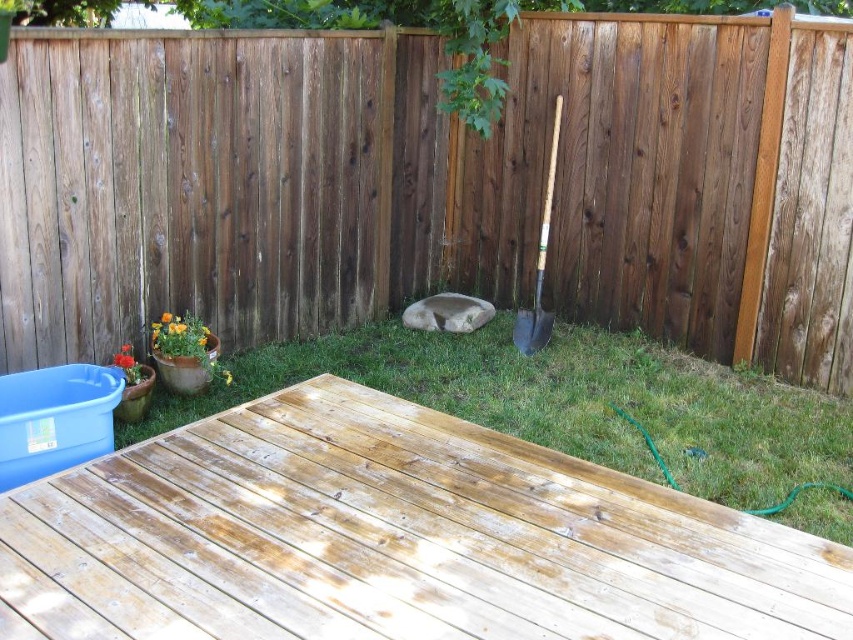
You are standing on the deck and want to see the brown wooden fence at upper center. Which direction should you look to see it above the green grass at center?

The brown wooden fence at upper center is above the green grass at center, so you should look upward to see it above the green grass at center.

Based on the photo, you are standing on the wooden handle shovel at center right and want to move to the weathered wood deck at lower left. Which direction should you go to reach it?

The weathered wood deck at lower left is positioned on the left side of the wooden handle shovel at center right. To reach it, you should move to the left side of the wooden handle shovel at center right.